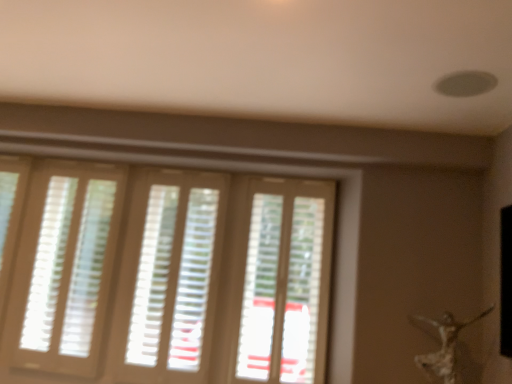
Question: Considering the positions of point (448, 337) and point (157, 352), is point (448, 337) closer or farther from the camera than point (157, 352)?

Choices:
 (A) closer
 (B) farther

Answer: (A)

Question: Is silver metallic statue at lower right in front of or behind white matte blinds at center, which is counted as the second blind, starting from the left, in the image?

Choices:
 (A) behind
 (B) front

Answer: (B)

Question: Based on their relative distances, which object is nearer to the white matte blinds at center, which is counted as the second blind, starting from the left?

Choices:
 (A) light beige wooden blinds at left, the second blind from the right
 (B) translucent plastic screen door at center
 (C) silver metallic statue at lower right

Answer: (A)

Question: Which object is the farthest from the light beige wooden blinds at left, the second blind from the right?

Choices:
 (A) silver metallic statue at lower right
 (B) translucent plastic screen door at center
 (C) white matte blinds at center, which is counted as the second blind, starting from the left

Answer: (A)